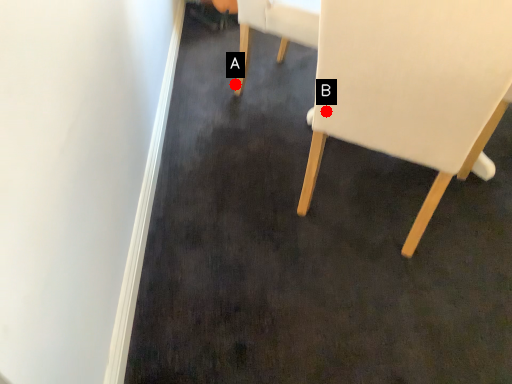
Question: Two points are circled on the image, labeled by A and B beside each circle. Among these points, which one is nearest to the camera?

Choices:
 (A) A is closer
 (B) B is closer

Answer: (B)